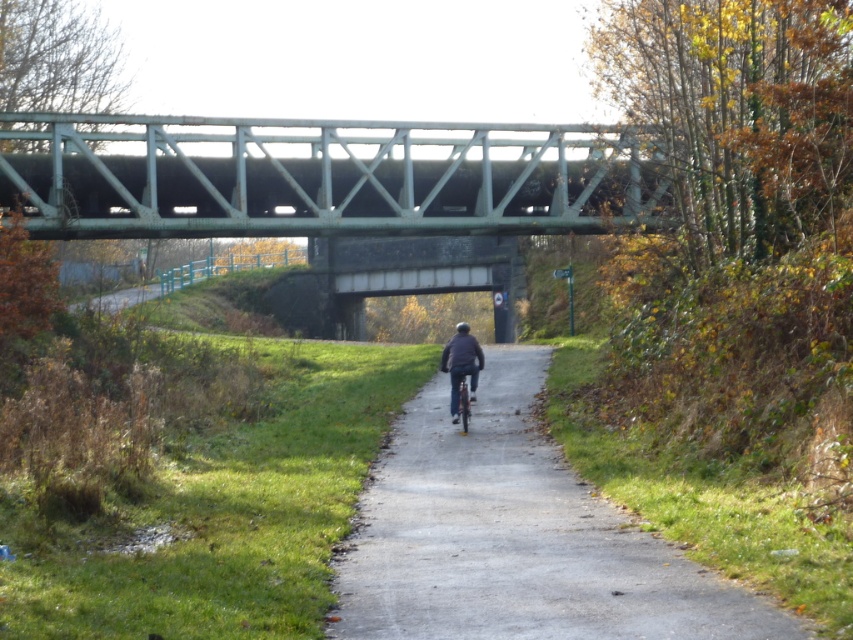
Question: Which point is farther from the camera taking this photo?

Choices:
 (A) 4,168
 (B) 456,342

Answer: (A)

Question: Among these objects, which one is farthest from the camera?

Choices:
 (A) smooth asphalt path at center
 (B) dark blue jacket at center
 (C) green painted steel bridge at upper center
 (D) metallic silver bicycle at center

Answer: (C)

Question: Does smooth asphalt path at center have a smaller size compared to dark blue jacket at center?

Choices:
 (A) yes
 (B) no

Answer: (B)

Question: Among these objects, which one is farthest from the camera?

Choices:
 (A) metallic silver bicycle at center
 (B) smooth asphalt path at center
 (C) dark blue jacket at center
 (D) green painted steel bridge at upper center

Answer: (D)

Question: Does green painted steel bridge at upper center appear under dark blue jacket at center?

Choices:
 (A) yes
 (B) no

Answer: (B)

Question: Does green painted steel bridge at upper center appear on the right side of metallic silver bicycle at center?

Choices:
 (A) yes
 (B) no

Answer: (B)